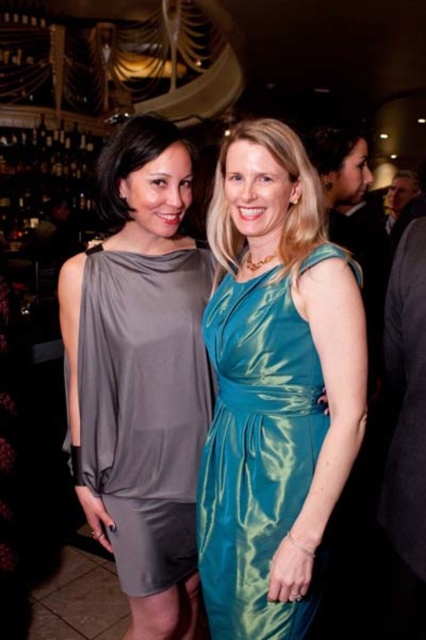
Can you confirm if matte gray dress at center is positioned to the right of teal satin dress at center?

No, matte gray dress at center is not to the right of teal satin dress at center.

Does point (172, 288) lie in front of point (221, 477)?

No, (172, 288) is further to viewer.

What are the coordinates of `matte gray dress at center` in the screenshot? It's located at (144, 404).